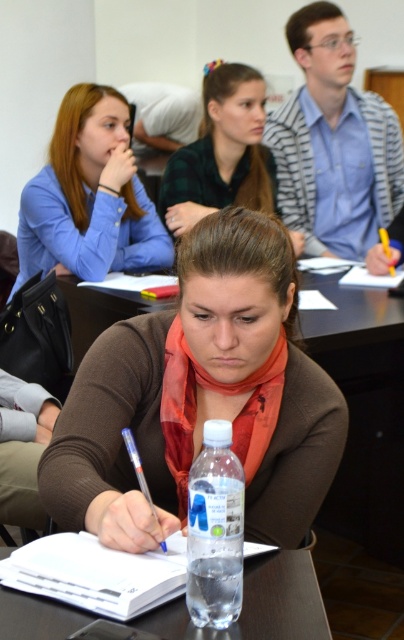
Question: Which object appears farthest from the camera in this image?

Choices:
 (A) green plaid shirt at upper center
 (B) matte blue shirt at upper left
 (C) clear plastic bottle at center
 (D) clear plastic water bottle at center

Answer: (A)

Question: Based on their relative distances, which object is farther from the brown matte scarf at center?

Choices:
 (A) clear plastic water bottle at center
 (B) clear plastic bottle at center
 (C) green plaid shirt at upper center
 (D) matte blue shirt at upper left

Answer: (C)

Question: Is matte blue shirt at upper left positioned at the back of clear plastic bottle at center?

Choices:
 (A) yes
 (B) no

Answer: (A)

Question: Can you confirm if clear plastic water bottle at center is positioned to the left of green plaid shirt at upper center?

Choices:
 (A) no
 (B) yes

Answer: (B)

Question: Is matte blue shirt at upper left thinner than green plaid shirt at upper center?

Choices:
 (A) yes
 (B) no

Answer: (B)

Question: Which object appears closest to the camera in this image?

Choices:
 (A) brown matte scarf at center
 (B) clear plastic bottle at center

Answer: (B)